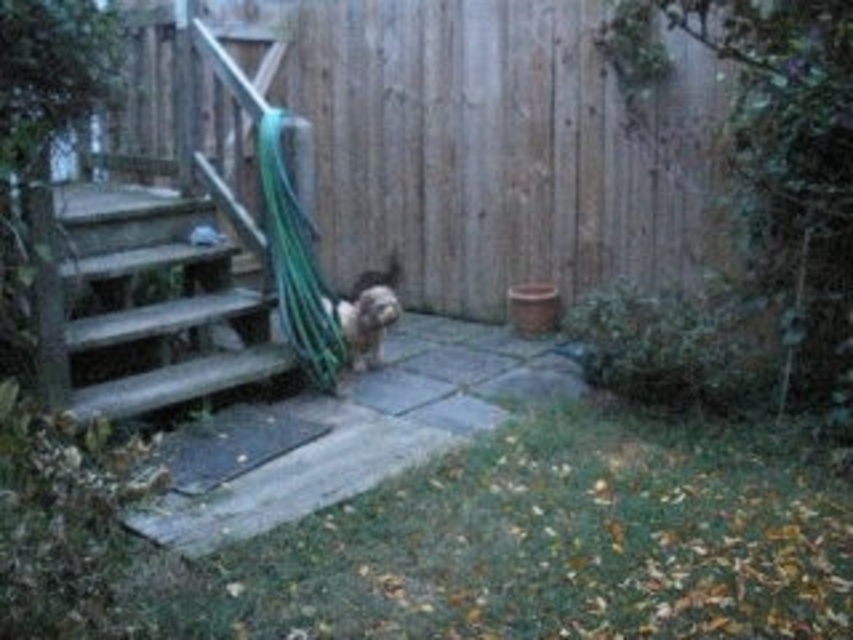
Question: Can you confirm if wooden stairs at left is smaller than green rubber hose at center?

Choices:
 (A) no
 (B) yes

Answer: (A)

Question: Which of the following is the farthest from the observer?

Choices:
 (A) (227, 280)
 (B) (393, 300)
 (C) (509, 230)

Answer: (C)

Question: Based on their relative distances, which object is nearer to the green rubber hose at center?

Choices:
 (A) wooden fence at center
 (B) wooden stairs at left

Answer: (B)

Question: Does wooden stairs at left have a larger size compared to green rubber hose at center?

Choices:
 (A) no
 (B) yes

Answer: (B)

Question: Does wooden stairs at left have a lesser width compared to green rubber hose at center?

Choices:
 (A) no
 (B) yes

Answer: (A)

Question: Which is nearer to the fuzzy brown dog at center?

Choices:
 (A) wooden stairs at left
 (B) wooden fence at center
 (C) green rubber hose at center

Answer: (C)